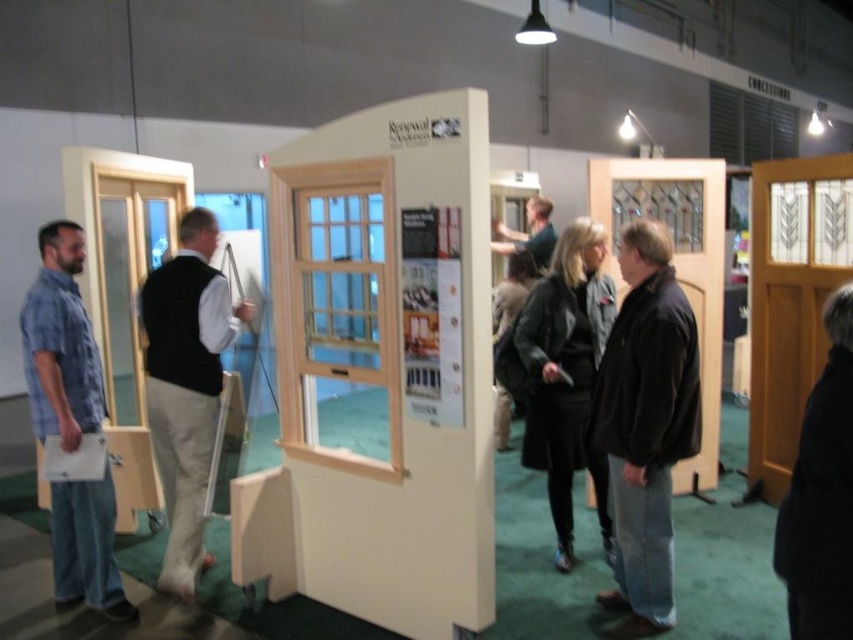
Question: Among these objects, which one is farthest from the camera?

Choices:
 (A) white wood door at center
 (B) light beige vest at center
 (C) brown leather jacket at center

Answer: (B)

Question: Where is white wood door at center located in relation to dark blue shirt at center in the image?

Choices:
 (A) right
 (B) left

Answer: (B)

Question: Can you confirm if light beige vest at center is positioned to the right of blue denim jeans at left?

Choices:
 (A) yes
 (B) no

Answer: (A)

Question: Which of the following is the closest to the observer?

Choices:
 (A) brown leather jacket at center
 (B) white wood door at center
 (C) dark blue shirt at center
 (D) black wool coat at lower right

Answer: (D)

Question: Which of the following is the farthest from the observer?

Choices:
 (A) light beige vest at center
 (B) white wood door at center

Answer: (A)

Question: Can you confirm if light beige vest at center is positioned to the right of dark blue shirt at center?

Choices:
 (A) no
 (B) yes

Answer: (A)